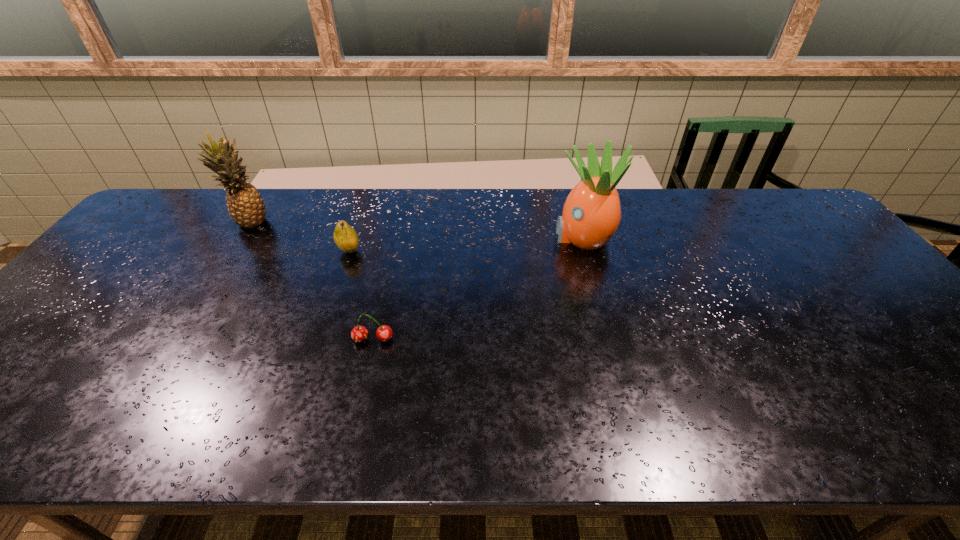
What are the coordinates of `the right pineapple` in the screenshot? It's located at (591, 214).

Find the location of `the left pineapple`. the left pineapple is located at coordinates (246, 207).

You are a GUI agent. You are given a task and a screenshot of the screen. Output one action in this format:
    pyautogui.click(x=<x>, y=<y>)
    Task: Click on the second object from left to right
    
    Given the screenshot: What is the action you would take?
    pyautogui.click(x=346, y=238)

Where is `the third tallest object`? the third tallest object is located at coordinates (346, 238).

Where is `the second object from right to left`? The height and width of the screenshot is (540, 960). the second object from right to left is located at coordinates (359, 333).

You are a GUI agent. You are given a task and a screenshot of the screen. Output one action in this format:
    pyautogui.click(x=<x>, y=<y>)
    Task: Click on the cherry
    The height and width of the screenshot is (540, 960).
    Given the screenshot: What is the action you would take?
    (359, 333)

Identify the location of vacant space situated at the entrance of the rightmost object. This screenshot has height=540, width=960. (529, 237).

Image resolution: width=960 pixels, height=540 pixels. What are the coordinates of `vacant region located 0.090m at the entrance of the rightmost object` in the screenshot? It's located at (522, 237).

Where is `free space located 0.310m at the entrance of the rightmost object`? This screenshot has width=960, height=540. free space located 0.310m at the entrance of the rightmost object is located at coordinates (451, 237).

Where is `vacant space situated on the front of the leftmost object`? The height and width of the screenshot is (540, 960). vacant space situated on the front of the leftmost object is located at coordinates (209, 286).